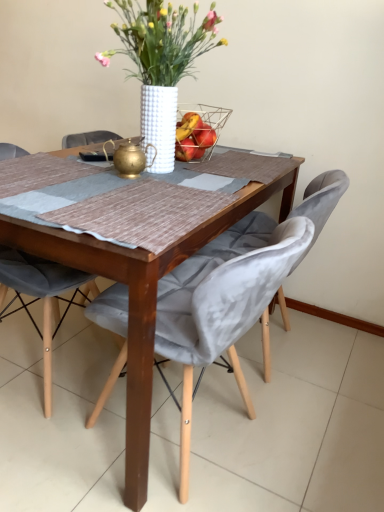
Where is `unoccupied region to the right of wire mesh basket at center`? This screenshot has width=384, height=512. unoccupied region to the right of wire mesh basket at center is located at coordinates (242, 161).